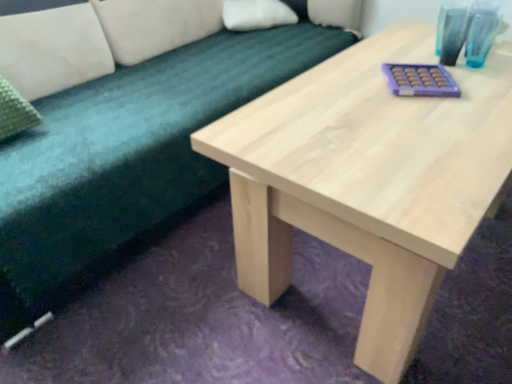
Question: Would you say soft green fabric couch at upper left is a long distance from clear glass vase at upper right?

Choices:
 (A) yes
 (B) no

Answer: (B)

Question: Does soft green fabric couch at upper left have a smaller size compared to clear glass vase at upper right?

Choices:
 (A) yes
 (B) no

Answer: (B)

Question: Can we say soft green fabric couch at upper left lies outside clear glass vase at upper right?

Choices:
 (A) no
 (B) yes

Answer: (B)

Question: Considering the relative sizes of soft green fabric couch at upper left and clear glass vase at upper right in the image provided, is soft green fabric couch at upper left shorter than clear glass vase at upper right?

Choices:
 (A) yes
 (B) no

Answer: (B)

Question: Does soft green fabric couch at upper left contain clear glass vase at upper right?

Choices:
 (A) yes
 (B) no

Answer: (B)

Question: In terms of width, does soft green fabric couch at upper left look wider or thinner when compared to natural wood table at center?

Choices:
 (A) thin
 (B) wide

Answer: (A)

Question: Which is correct: soft green fabric couch at upper left is inside natural wood table at center, or outside of it?

Choices:
 (A) inside
 (B) outside

Answer: (B)

Question: Considering the positions of soft green fabric couch at upper left and natural wood table at center in the image, is soft green fabric couch at upper left bigger or smaller than natural wood table at center?

Choices:
 (A) small
 (B) big

Answer: (B)

Question: Considering the positions of point [196, 54] and point [250, 107], is point [196, 54] closer or farther from the camera than point [250, 107]?

Choices:
 (A) farther
 (B) closer

Answer: (A)

Question: Looking at their shapes, would you say soft green fabric couch at upper left is wider or thinner than teal glass at upper right?

Choices:
 (A) wide
 (B) thin

Answer: (A)

Question: Considering the positions of point (25, 193) and point (489, 39), is point (25, 193) closer or farther from the camera than point (489, 39)?

Choices:
 (A) closer
 (B) farther

Answer: (A)

Question: In the image, is soft green fabric couch at upper left positioned in front of or behind teal glass at upper right?

Choices:
 (A) front
 (B) behind

Answer: (A)

Question: Would you say soft green fabric couch at upper left is to the left or to the right of teal glass at upper right in the picture?

Choices:
 (A) right
 (B) left

Answer: (B)

Question: Considering the positions of teal glass at upper right and soft green fabric couch at upper left in the image, is teal glass at upper right taller or shorter than soft green fabric couch at upper left?

Choices:
 (A) short
 (B) tall

Answer: (A)

Question: Relative to soft green fabric couch at upper left, is teal glass at upper right in front or behind?

Choices:
 (A) behind
 (B) front

Answer: (A)